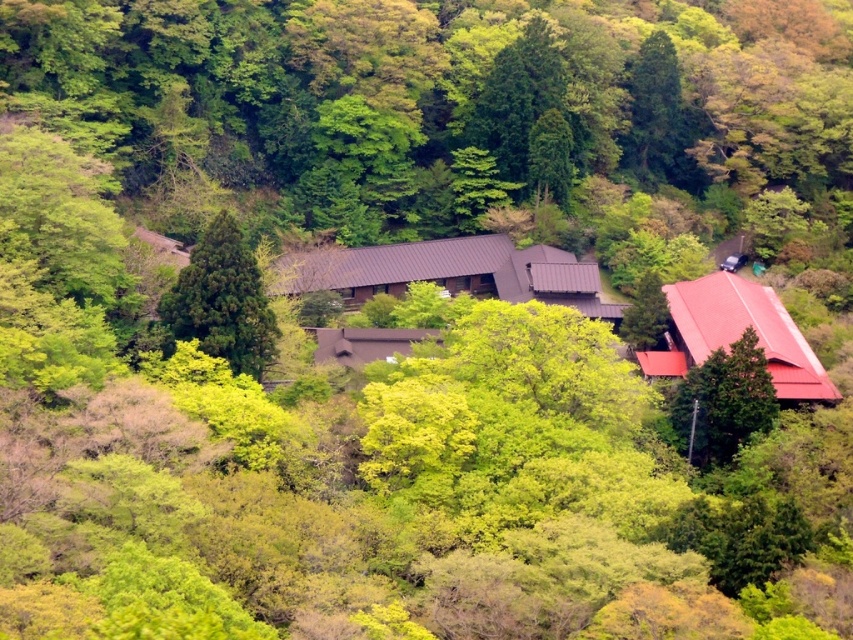
You are a hiker who wants to take a photo of the green leafy tree at upper center. However, there is a brown corrugated metal hut at center blocking your view. Can you still see the tree through the hut?

The brown corrugated metal hut at center is in front of the green leafy tree at upper center, so the tree is blocked by the hut and cannot be seen through it.

Consider the image. You are a visitor in the forest and want to take a photo of both the red metal roof at right and the brown matte hut at center. Which building should you position yourself to the left of to capture both in the frame?

To capture both the red metal roof at right and the brown matte hut at center in your photo, you should position yourself to the left of the brown matte hut at center. Since the red metal roof at right is to the right of the brown matte hut at center, this positioning will allow both structures to be included in the frame.

You are a hiker trying to reach the brown matte hut at center from the trail. There is a green matte tree at right blocking your path. Can you walk around it to get to the hut?

The green matte tree at right is in front of the brown matte hut at center, so you can walk around the green matte tree at right to reach the brown matte hut at center.